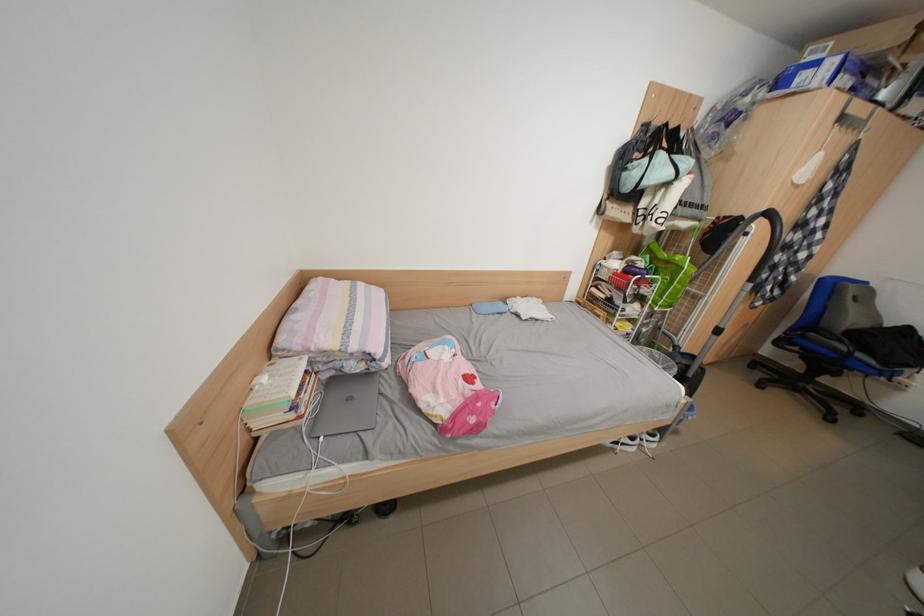
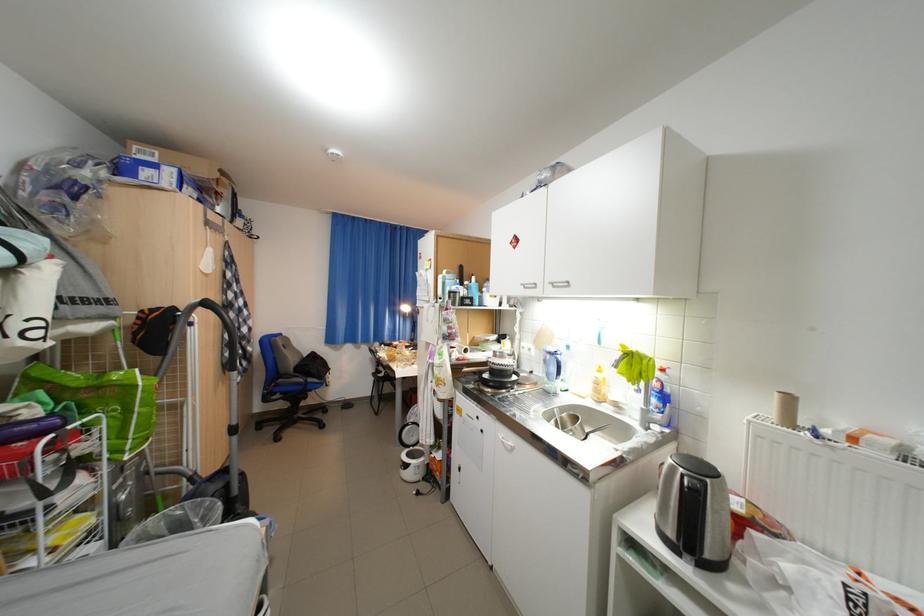
Find the pixel in the second image that matches point 805,345 in the first image.

(286, 395)